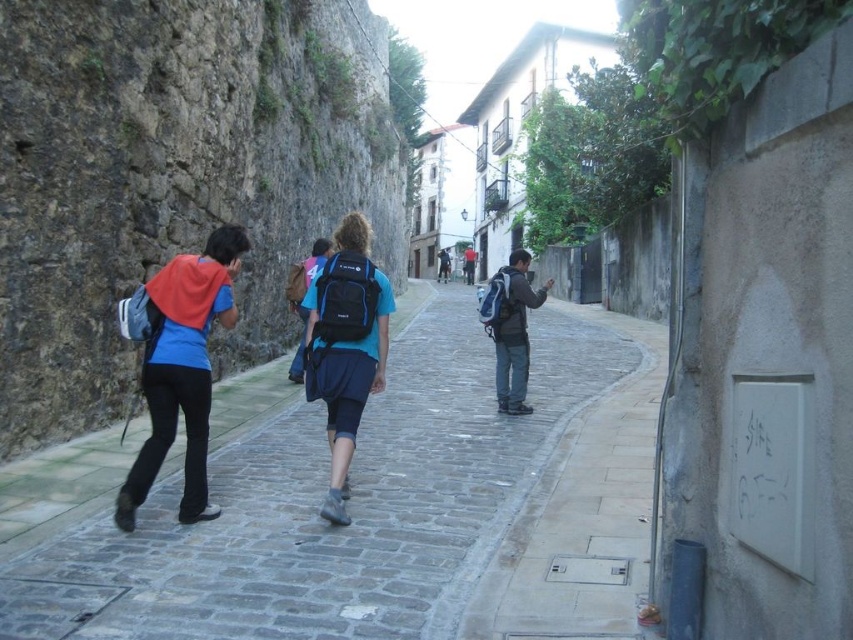
Question: Can you confirm if cobblestone pavement at center is positioned to the left of metallic gray manhole cover at center-right?

Choices:
 (A) yes
 (B) no

Answer: (A)

Question: Which point is farther to the camera?

Choices:
 (A) blue fabric backpack at center
 (B) matte blue backpack at center

Answer: (B)

Question: Which of the following is the closest to the observer?

Choices:
 (A) matte blue backpack at center
 (B) matte blue backpack at left
 (C) blue matte backpack at center
 (D) blue fabric backpack at center

Answer: (B)

Question: Is metallic gray manhole cover at center-right to the left of blue matte backpack at center from the viewer's perspective?

Choices:
 (A) yes
 (B) no

Answer: (B)

Question: Does cobblestone pavement at center appear over matte blue backpack at left?

Choices:
 (A) yes
 (B) no

Answer: (B)

Question: Estimate the real-world distances between objects in this image. Which object is farther from the matte blue backpack at left?

Choices:
 (A) blue matte backpack at center
 (B) cobblestone pavement at center
 (C) metallic gray manhole cover at center-right
 (D) blue fabric backpack at center

Answer: (C)